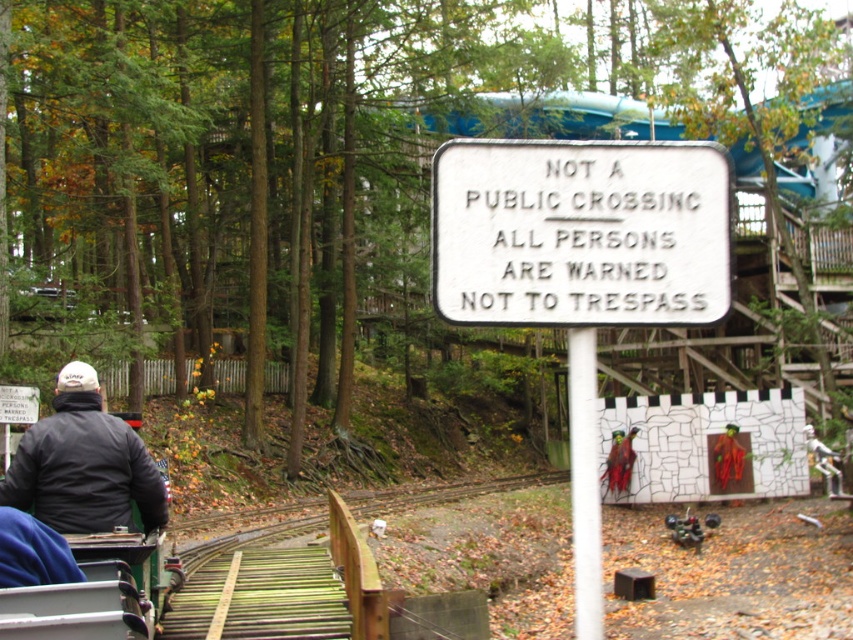
Question: Is white plastic sign at center below dark gray jacket at lower left?

Choices:
 (A) yes
 (B) no

Answer: (B)

Question: Which object appears farthest from the camera in this image?

Choices:
 (A) wooden at center
 (B) dark gray jacket at lower left

Answer: (B)

Question: Which object is the closest to the white plastic sign at center?

Choices:
 (A) wooden at center
 (B) white paper sign at center
 (C) dark gray jacket at lower left

Answer: (B)

Question: Does white paper sign at center appear under white plastic sign at center?

Choices:
 (A) no
 (B) yes

Answer: (B)

Question: Is wooden at center above dark gray jacket at lower left?

Choices:
 (A) yes
 (B) no

Answer: (B)

Question: Which point is closer to the camera taking this photo?

Choices:
 (A) (329, 589)
 (B) (80, 403)
 (C) (437, 177)
 (D) (672, 148)

Answer: (C)